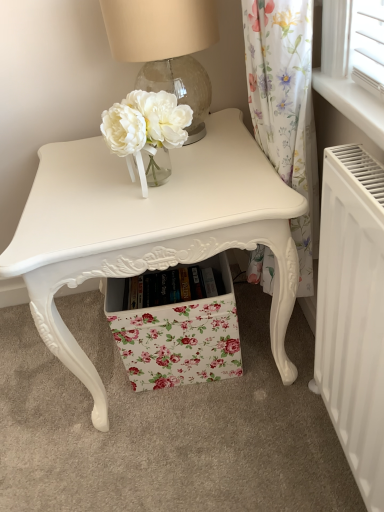
The height and width of the screenshot is (512, 384). I want to click on vacant space situated on the left part of matte white table at center, so click(x=42, y=382).